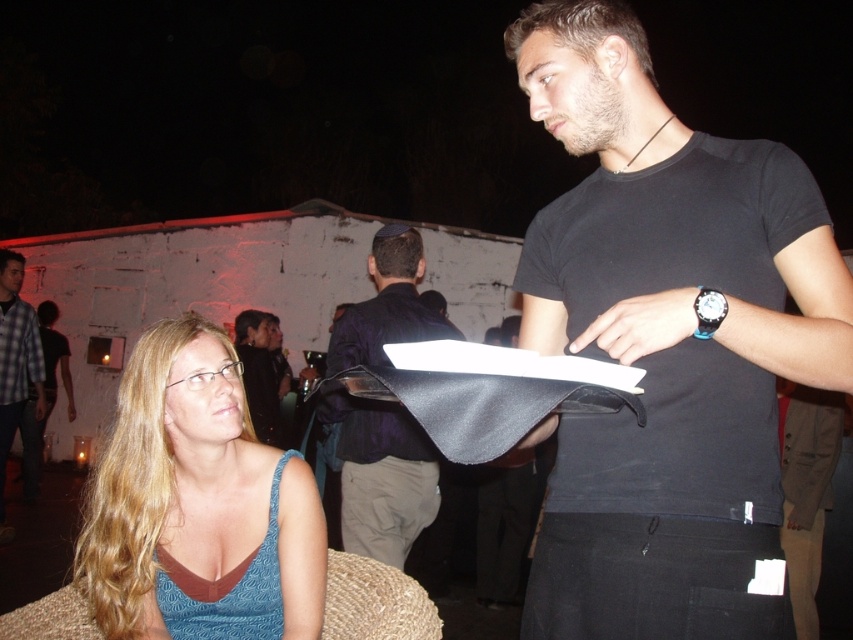
Question: Is black matte t-shirt at center to the right of blue fabric dress at lower left from the viewer's perspective?

Choices:
 (A) no
 (B) yes

Answer: (B)

Question: Where is blue fabric dress at lower left located in relation to dark blue fabric at center in the image?

Choices:
 (A) left
 (B) right

Answer: (A)

Question: Which point is closer to the camera?

Choices:
 (A) black matte t-shirt at center
 (B) dark blue fabric at center

Answer: (A)

Question: Which of the following is the closest to the observer?

Choices:
 (A) (701, 176)
 (B) (248, 412)

Answer: (A)

Question: Which point is closer to the camera taking this photo?

Choices:
 (A) (699, 536)
 (B) (276, 445)
 (C) (1, 419)

Answer: (A)

Question: Is dark blue fabric at center wider than checkered fabric shirt at left?

Choices:
 (A) no
 (B) yes

Answer: (A)